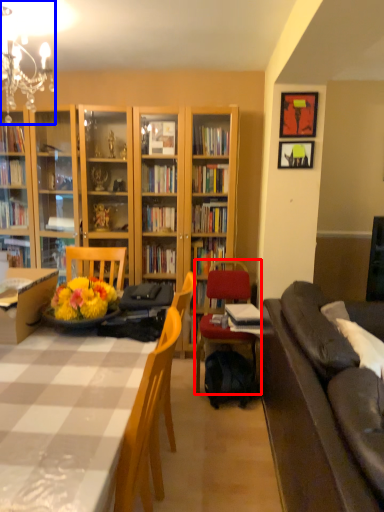
Question: Which object appears farthest to the camera in this image, chair (highlighted by a red box) or lamp (highlighted by a blue box)?

Choices:
 (A) chair
 (B) lamp

Answer: (A)